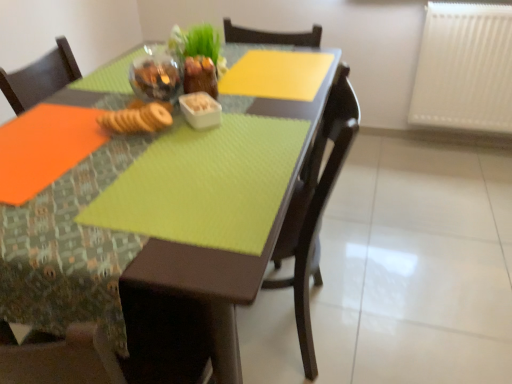
The width and height of the screenshot is (512, 384). Identify the location of free space that is to the left of translucent glass bowl at upper center, the second tableware viewed from the right. (98, 100).